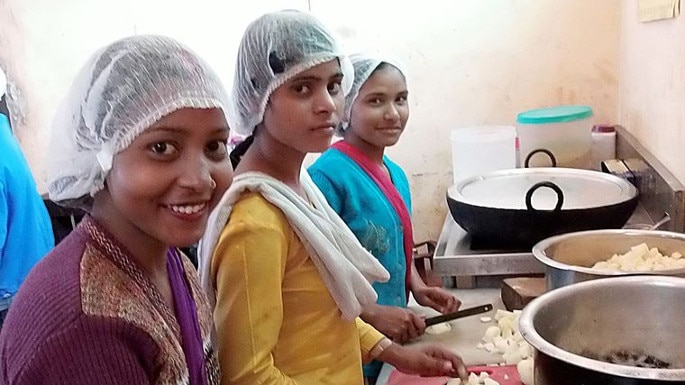
The image size is (685, 385). In order to click on canisters in this screenshot , I will do `click(575, 140)`, `click(486, 148)`.